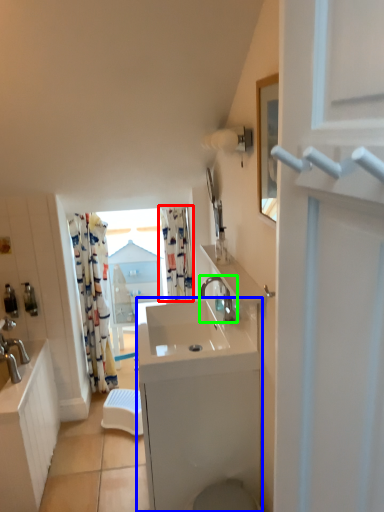
Question: Considering the real-world distances, which object is closest to curtain (highlighted by a red box)? counter top (highlighted by a blue box) or tap (highlighted by a green box).

Choices:
 (A) counter top
 (B) tap

Answer: (B)